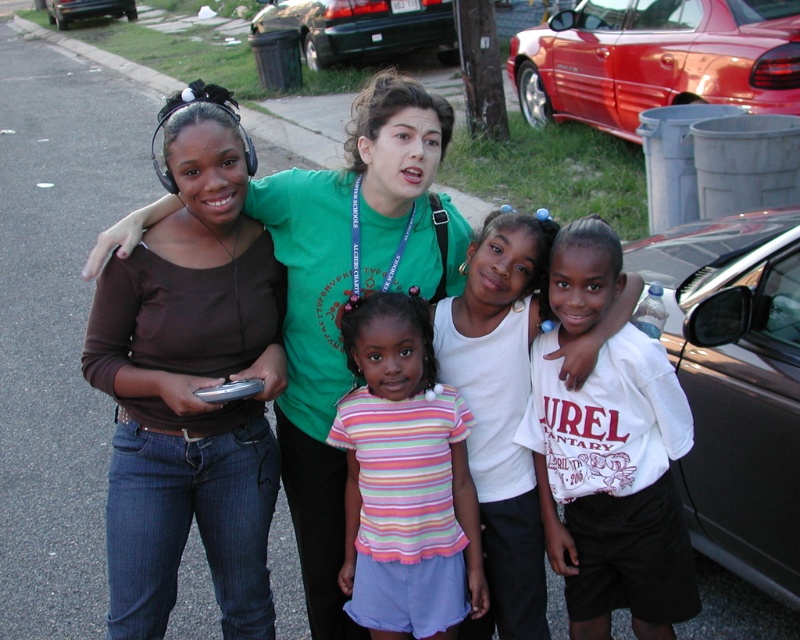
Question: Which of the following is the farthest from the observer?

Choices:
 (A) red metallic car at right
 (B) green matte car at upper center

Answer: (B)

Question: Which of the following is the farthest from the observer?

Choices:
 (A) green matte car at upper center
 (B) metallic gray car at right
 (C) shiny black car at upper left

Answer: (C)

Question: Considering the real-world distances, which object is closest to the white cotton shirt at right?

Choices:
 (A) shiny black car at upper left
 (B) metallic gray car at right

Answer: (B)

Question: Considering the relative positions of matte green t-shirt at center and white cotton shirt at right in the image provided, where is matte green t-shirt at center located with respect to white cotton shirt at right?

Choices:
 (A) above
 (B) below

Answer: (A)

Question: Is metallic gray car at right bigger than red metallic car at right?

Choices:
 (A) yes
 (B) no

Answer: (B)

Question: Is red metallic car at right to the left of green matte car at upper center from the viewer's perspective?

Choices:
 (A) yes
 (B) no

Answer: (B)